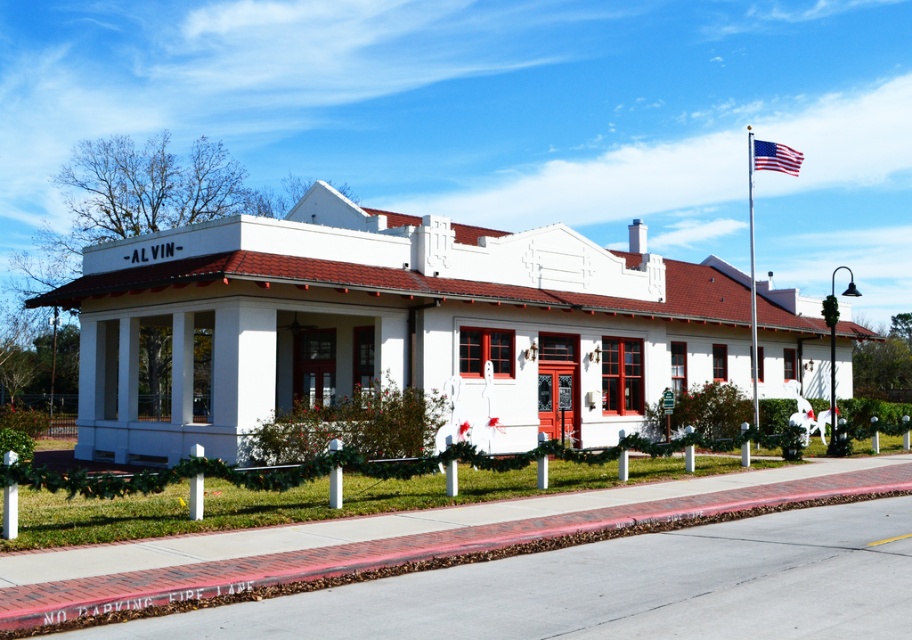
You are a visitor standing in front of the ALVIN building. You see the metallic flag pole at center and the american flag at upper right. Which object is positioned higher from the ground?

The american flag at upper right is positioned higher from the ground because the metallic flag pole at center is below it.

You are standing in front of the building labeled ALVIN and want to place a new flowerpot. The flowerpot must be placed at the point marked by the coordinates point (403, 550). What material will the flowerpot be placed on?

The point (403, 550) indicates brick at lower center, so the flowerpot will be placed on brick.